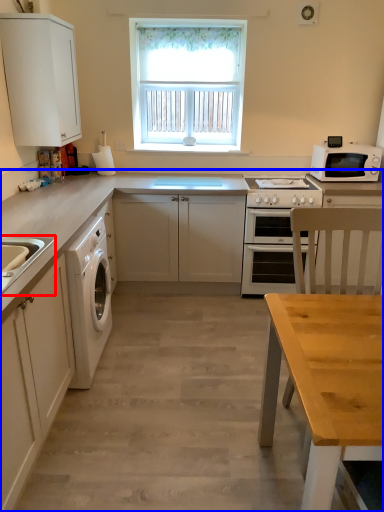
Question: Which point is closer to the camera, sink (highlighted by a red box) or countertop (highlighted by a blue box)?

Choices:
 (A) sink
 (B) countertop

Answer: (A)